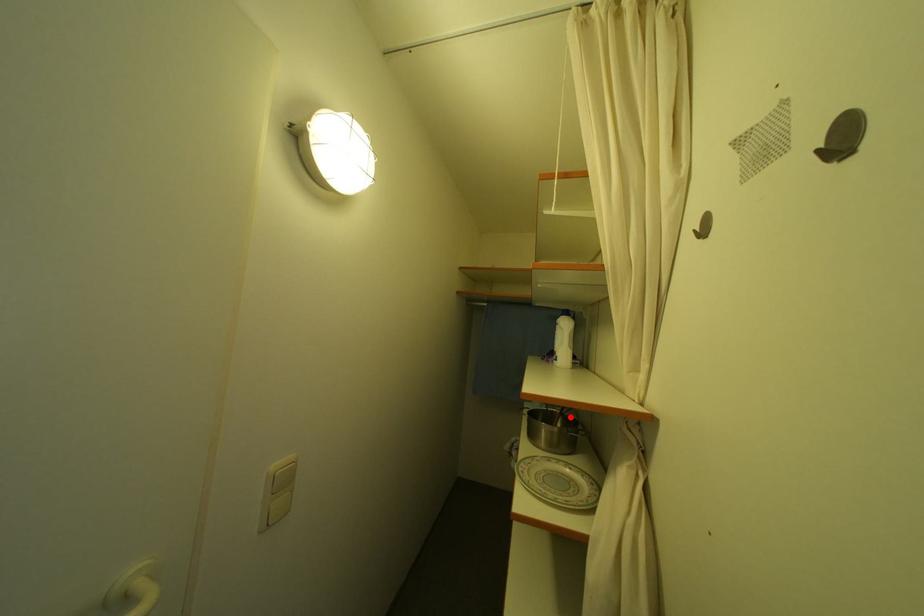
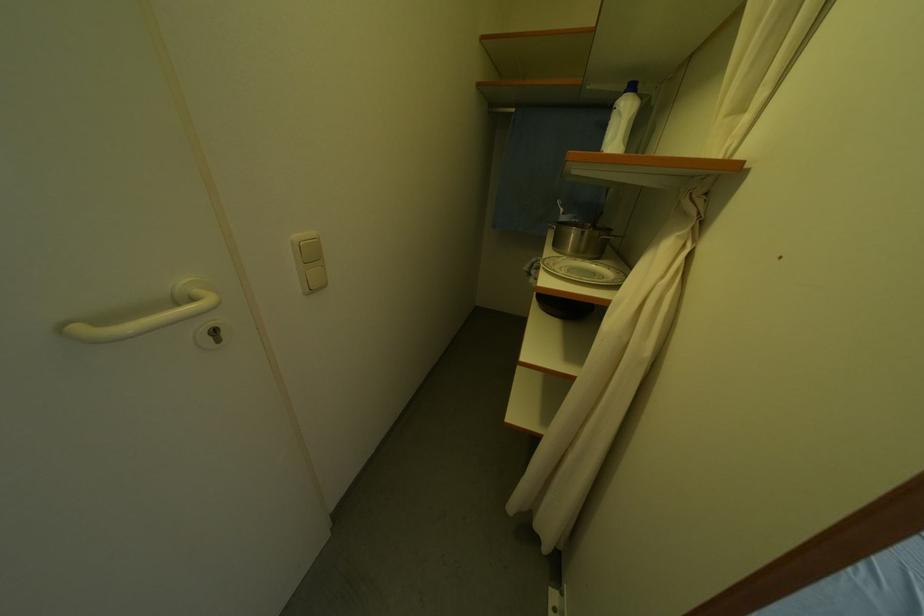
Where in the second image is the point corresponding to the highlighted location from the first image?

(602, 228)